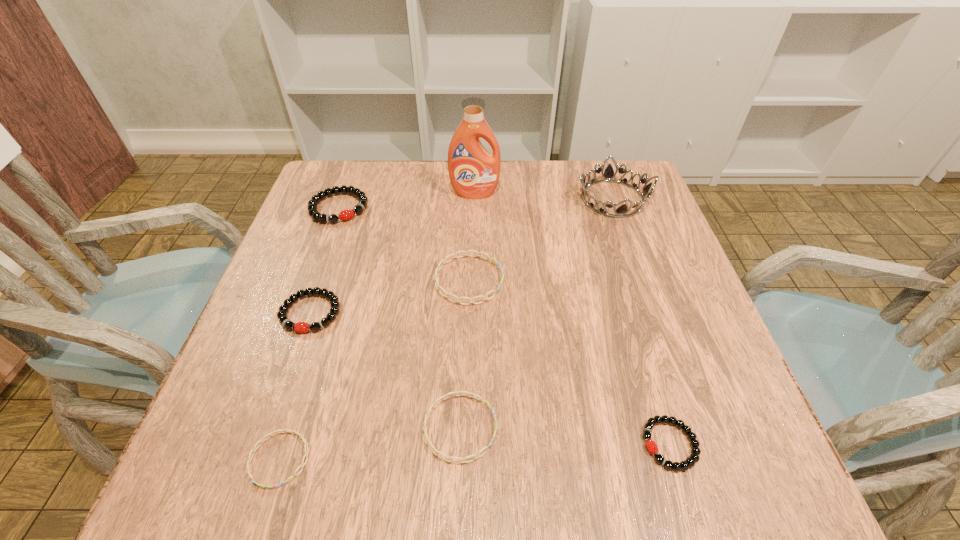
Locate an element on the screen. Image resolution: width=960 pixels, height=540 pixels. empty location between the second tallest object and the tallest object is located at coordinates (543, 196).

The width and height of the screenshot is (960, 540). What are the coordinates of `free space between the second smallest blue bracelet and the leftmost blue bracelet` in the screenshot? It's located at (370, 443).

This screenshot has height=540, width=960. Find the location of `vacant area that lies between the leftmost blue bracelet and the rightmost black bracelet`. vacant area that lies between the leftmost blue bracelet and the rightmost black bracelet is located at coordinates (475, 451).

You are a GUI agent. You are given a task and a screenshot of the screen. Output one action in this format:
    pyautogui.click(x=<x>, y=<y>)
    Task: Click on the unoccupied position between the biggest blue bracelet and the detergent
    
    Given the screenshot: What is the action you would take?
    pyautogui.click(x=471, y=237)

The width and height of the screenshot is (960, 540). I want to click on empty space that is in between the biggest blue bracelet and the tiara, so click(540, 239).

Locate which object is the second closest to the second biggest blue bracelet. Please provide its 2D coordinates. Your answer should be formatted as a tuple, i.e. [(x, y)], where the tuple contains the x and y coordinates of a point satisfying the conditions above.

[(493, 259)]

The image size is (960, 540). What are the coordinates of `object that is the second nearest to the farthest blue bracelet` in the screenshot? It's located at (463, 460).

Locate an element on the screen. bracelet that stands as the third closest to the second biggest blue bracelet is located at coordinates (334, 304).

Identify the location of bracelet object that ranks as the second closest to the second smallest blue bracelet. (493, 259).

You are a GUI agent. You are given a task and a screenshot of the screen. Output one action in this format:
    pyautogui.click(x=<x>, y=<y>)
    Task: Click on the black bracelet that is the third closest to the seventh shortest object
    This screenshot has height=540, width=960.
    Given the screenshot: What is the action you would take?
    pyautogui.click(x=334, y=304)